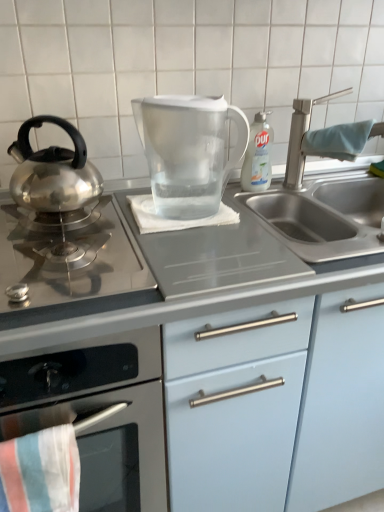
Question: Is blue fabric towel at sink right, the first beach towel when ordered from back to front, situated inside polished stainless steel kettle at left, the second kitchen appliance viewed from the top, or outside?

Choices:
 (A) inside
 (B) outside

Answer: (B)

Question: Relative to polished stainless steel kettle at left, which ranks as the 2th kitchen appliance in bottom-to-top order, is blue fabric towel at sink right, which ranks as the 3th beach towel in left-to-right order, in front or behind?

Choices:
 (A) front
 (B) behind

Answer: (B)

Question: Based on their relative distances, which object is farther from the transparent plastic pitcher at center, arranged as the 3th kitchen appliance when ordered from the bottom?

Choices:
 (A) white cloth at center, marked as the second beach towel in a right-to-left arrangement
 (B) striped cotton beach towel at lower left, the 1th beach towel positioned from the front
 (C) light blue matte cabinet at center
 (D) stainless steel kettle at left, which ranks as the third kitchen appliance in top-to-bottom order
 (E) satin nickel faucet at upper right

Answer: (B)

Question: Which of these objects is positioned farthest from the light blue matte cabinet at center?

Choices:
 (A) satin silver gas stove at left
 (B) stainless steel kettle at left, the first kitchen appliance in the bottom-to-top sequence
 (C) transparent plastic pitcher at center, which is counted as the 1th kitchen appliance, starting from the top
 (D) clear plastic bottle at upper right
 (E) blue fabric towel at sink right, which ranks as the first beach towel in top-to-bottom order

Answer: (E)